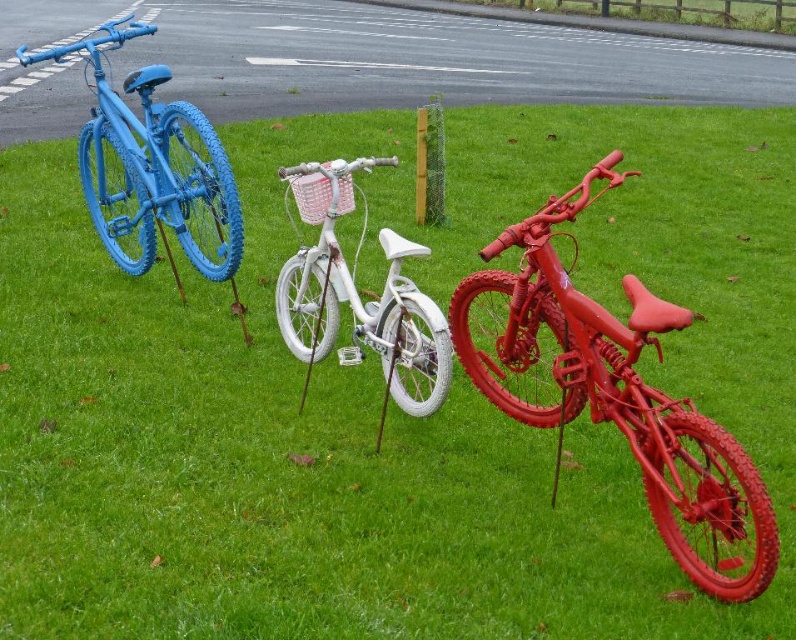
You are standing in front of the white bicycle in the center. There are two points marked on it. One is at coordinates point (x=568, y=316) and the other is at point (x=328, y=324). Which point is closer to you?

Point (x=568, y=316) is closer to the viewer than point (x=328, y=324).

You are a delivery person needing to move a package from the shiny red bicycle at right to the white glossy bicycle at center. Which bicycle do you need to approach first?

You should approach the shiny red bicycle at right first because it is in front of the white glossy bicycle at center, making it closer to you.

You are a delivery person who needs to choose a bicycle to carry packages. You notice the matte blue bicycle at left and the white glossy bicycle at center. Which bicycle is taller, and why might that matter for carrying packages?

The matte blue bicycle at left is much taller than the white glossy bicycle at center. The taller frame might provide more stability or a higher load capacity, which could be beneficial for carrying packages.